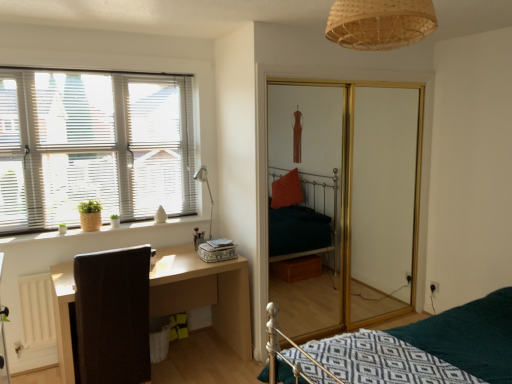
I want to click on free region under gold-framed glass screen door at center (from a real-world perspective), so (x=357, y=319).